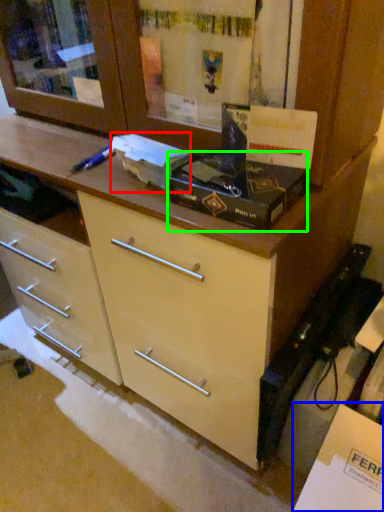
Question: Based on their relative distances, which object is farther from box (highlighted by a red box)? Choose from cabinetry (highlighted by a blue box) and box (highlighted by a green box).

Choices:
 (A) cabinetry
 (B) box

Answer: (A)